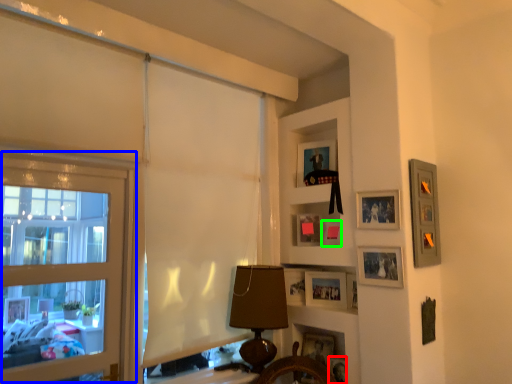
Question: Which is farther away from picture frame (highlighted by a red box)? window (highlighted by a blue box) or picture frame (highlighted by a green box)?

Choices:
 (A) window
 (B) picture frame

Answer: (A)